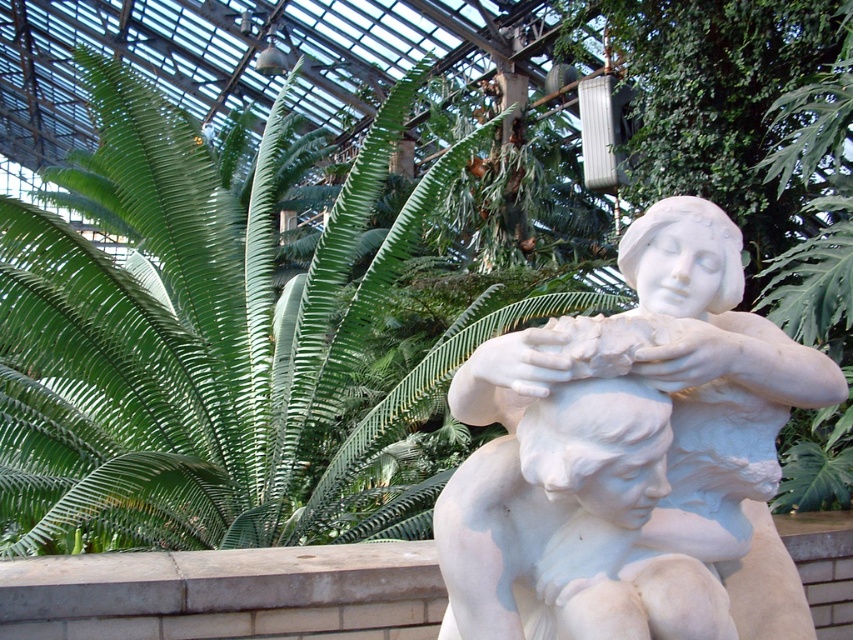
Is point (219, 369) behind point (614, 422)?

Yes, it is behind point (614, 422).

The image size is (853, 640). I want to click on green leafy fern at center, so click(x=209, y=344).